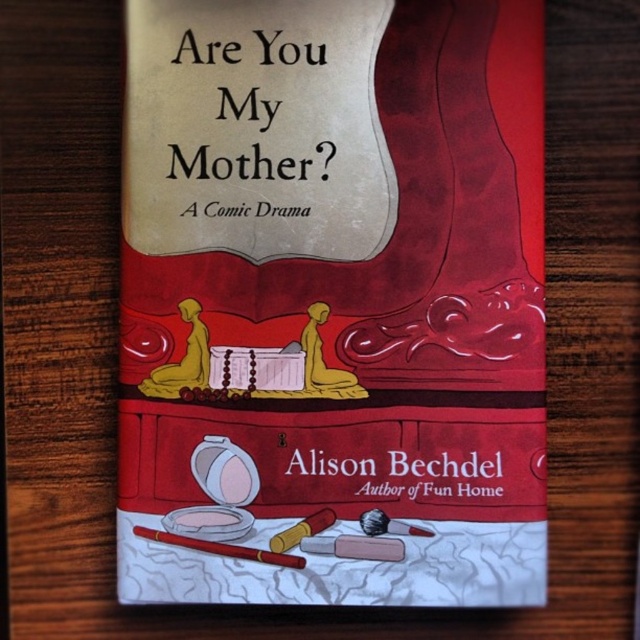
Question: Does matte paper book at center appear over smooth brown pencil at bottom center?

Choices:
 (A) yes
 (B) no

Answer: (A)

Question: Which point is farther to the camera?

Choices:
 (A) (192, 538)
 (B) (296, 582)

Answer: (B)

Question: Where is matte paper book at center located in relation to smooth brown pencil at bottom center in the image?

Choices:
 (A) right
 (B) left

Answer: (A)

Question: Is matte paper book at center above smooth brown pencil at bottom center?

Choices:
 (A) yes
 (B) no

Answer: (A)

Question: Which of the following is the farthest from the observer?

Choices:
 (A) matte paper book at center
 (B) smooth brown pencil at bottom center

Answer: (B)